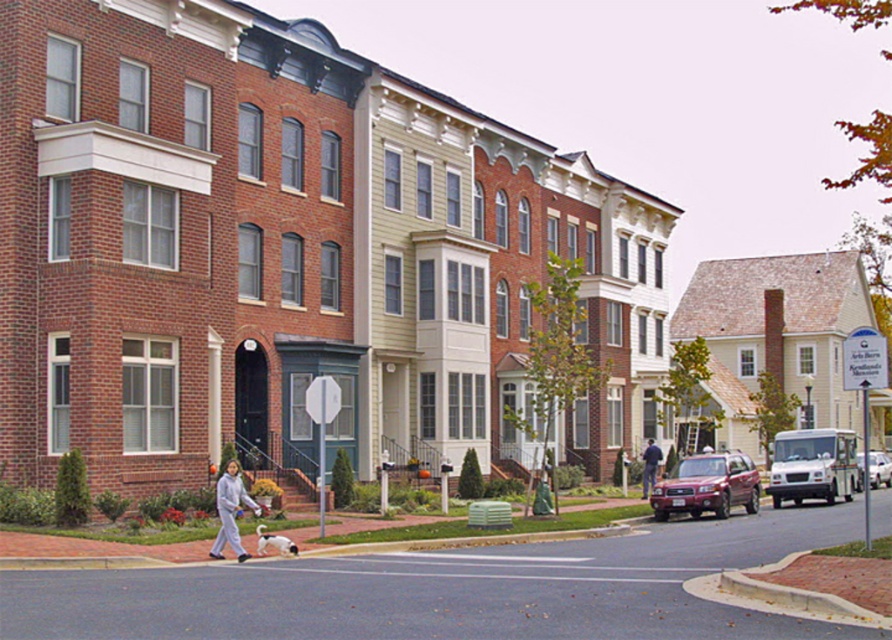
Question: Does gray fleece jacket at lower center come in front of metallic silver sedan at center?

Choices:
 (A) yes
 (B) no

Answer: (A)

Question: Which object is farther from the camera taking this photo?

Choices:
 (A) metallic silver sedan at center
 (B) dark gray pants at center

Answer: (A)

Question: Does matte red suv at center appear on the left side of gray fleece jacket at lower center?

Choices:
 (A) yes
 (B) no

Answer: (B)

Question: Which object is positioned farthest from the dark gray pants at center?

Choices:
 (A) matte red suv at center
 (B) metallic silver sedan at center
 (C) white fur dog at lower center
 (D) gray fleece jacket at lower center

Answer: (D)

Question: Which point appears farthest from the camera in this image?

Choices:
 (A) (863, 456)
 (B) (223, 508)
 (C) (643, 468)

Answer: (A)

Question: Does matte red suv at center have a smaller size compared to gray fleece jacket at lower center?

Choices:
 (A) no
 (B) yes

Answer: (A)